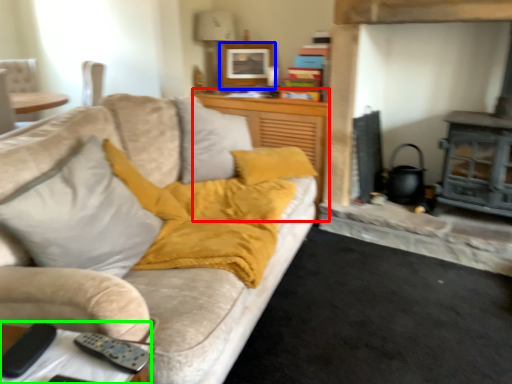
Question: Estimate the real-world distances between objects in this image. Which object is closer to dresser (highlighted by a red box), picture frame (highlighted by a blue box) or table (highlighted by a green box)?

Choices:
 (A) picture frame
 (B) table

Answer: (A)